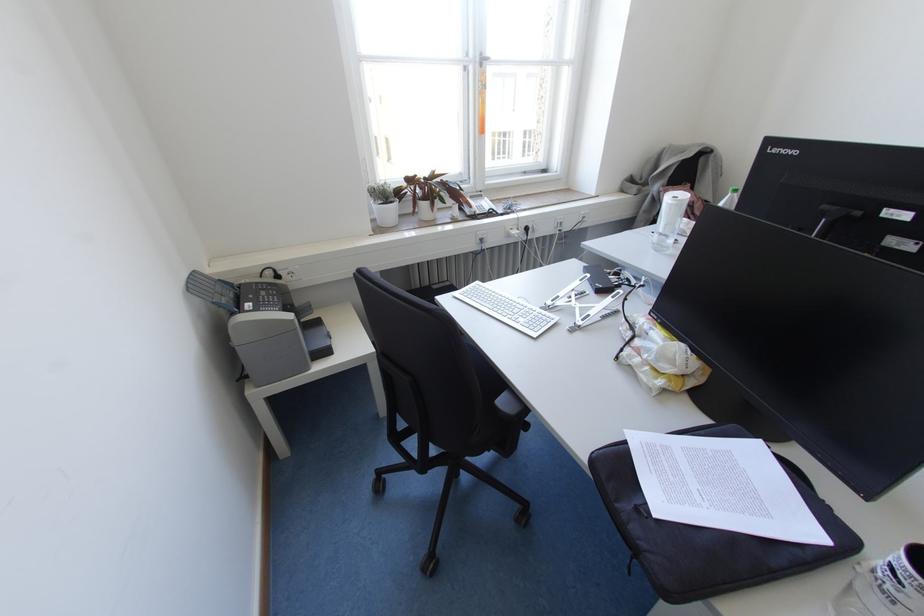
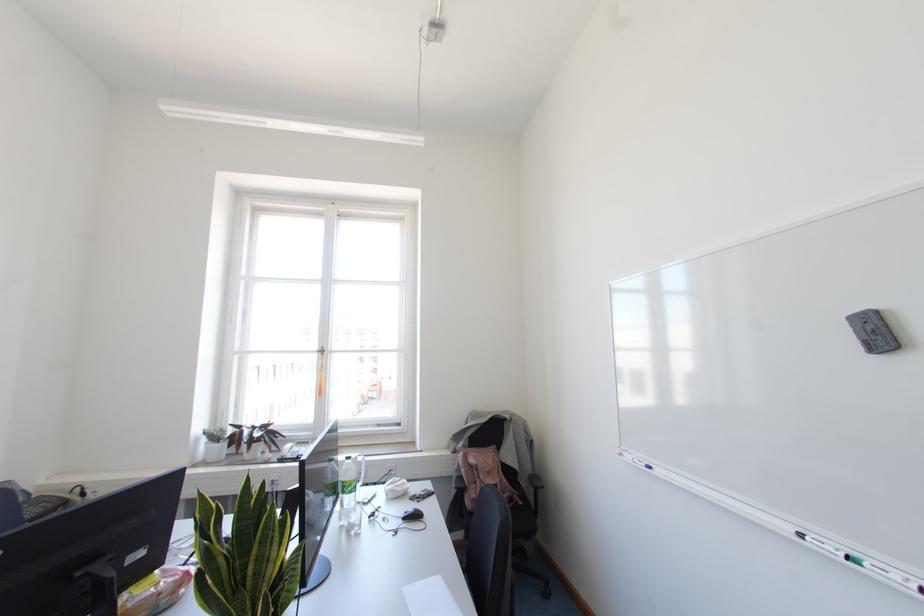
Locate, in the second image, the point that corresponds to (262,289) in the first image.

(46, 501)